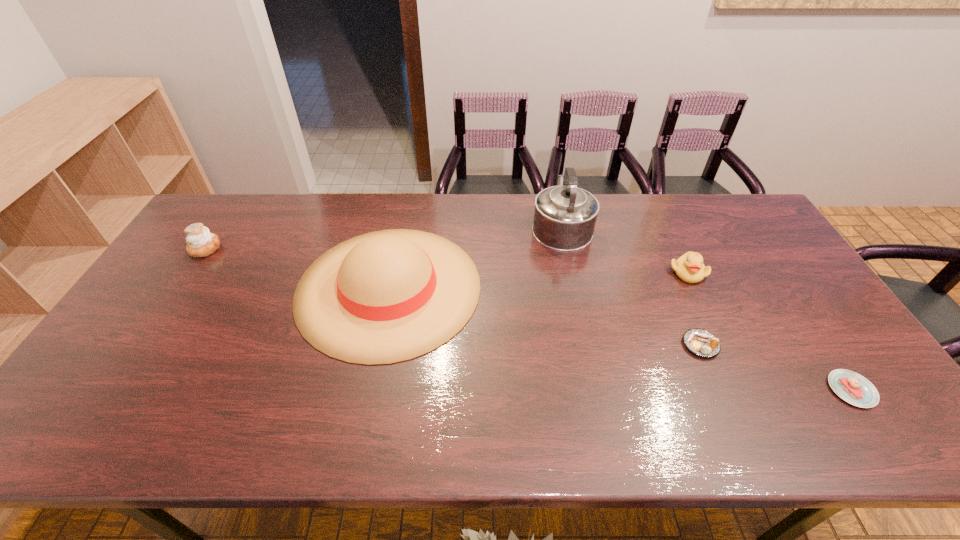
Image resolution: width=960 pixels, height=540 pixels. I want to click on object that is at the near right corner, so click(852, 387).

In the image, there is a desktop. Identify the location of blank space at the far edge. The image size is (960, 540). (461, 233).

Identify the location of vacant space at the near edge of the desktop. The height and width of the screenshot is (540, 960). (823, 437).

This screenshot has width=960, height=540. I want to click on vacant space at the left edge of the desktop, so click(x=150, y=334).

Where is `vacant space at the far left corner`? The height and width of the screenshot is (540, 960). vacant space at the far left corner is located at coordinates pyautogui.click(x=235, y=201).

In order to click on free region at the near left corner in this screenshot , I will do `click(100, 432)`.

The width and height of the screenshot is (960, 540). I want to click on empty space between the second pastry from right to left and the rightmost pastry, so click(776, 367).

Where is `free space between the third object from left to right and the duckling`? free space between the third object from left to right and the duckling is located at coordinates (624, 249).

Locate an element on the screen. free space between the tallest object and the second nearest pastry is located at coordinates (631, 285).

Locate an element on the screen. Image resolution: width=960 pixels, height=540 pixels. vacant area that lies between the duckling and the rightmost pastry is located at coordinates pos(770,331).